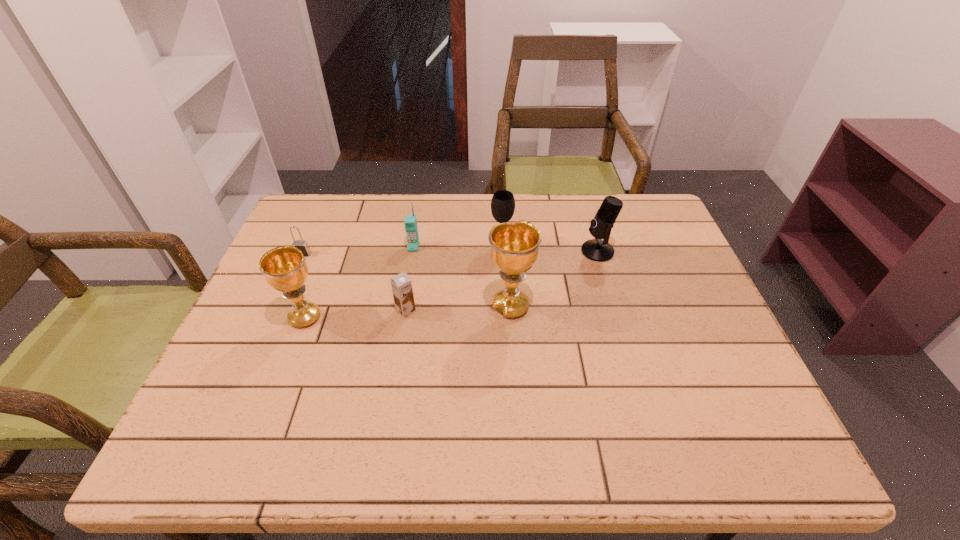
Where is `wineglass that is at the far edge`? wineglass that is at the far edge is located at coordinates (503, 203).

Locate an element on the screen. The height and width of the screenshot is (540, 960). chalice that is at the left edge is located at coordinates (285, 269).

The height and width of the screenshot is (540, 960). In order to click on padlock situated at the left edge in this screenshot , I will do `click(302, 245)`.

You are a GUI agent. You are given a task and a screenshot of the screen. Output one action in this format:
    pyautogui.click(x=<x>, y=<y>)
    Task: Click on the vacant region at the far edge of the desktop
    
    Given the screenshot: What is the action you would take?
    pyautogui.click(x=409, y=194)

In the image, there is a desktop. Where is `free space at the near edge`? The width and height of the screenshot is (960, 540). free space at the near edge is located at coordinates (444, 401).

You are a GUI agent. You are given a task and a screenshot of the screen. Output one action in this format:
    pyautogui.click(x=<x>, y=<y>)
    Task: Click on the vacant space at the left edge of the desktop
    The width and height of the screenshot is (960, 540).
    Given the screenshot: What is the action you would take?
    pyautogui.click(x=237, y=339)

You are a GUI agent. You are given a task and a screenshot of the screen. Output one action in this format:
    pyautogui.click(x=<x>, y=<y>)
    Task: Click on the vacant space at the right edge
    This screenshot has width=960, height=540.
    Given the screenshot: What is the action you would take?
    pyautogui.click(x=679, y=275)

The image size is (960, 540). Identify the location of vacant space at the near left corner of the desktop. (222, 393).

The height and width of the screenshot is (540, 960). In order to click on free location at the far right corner of the desktop in this screenshot , I will do `click(629, 240)`.

This screenshot has height=540, width=960. I want to click on free spot between the tallest object and the rightmost object, so click(x=554, y=279).